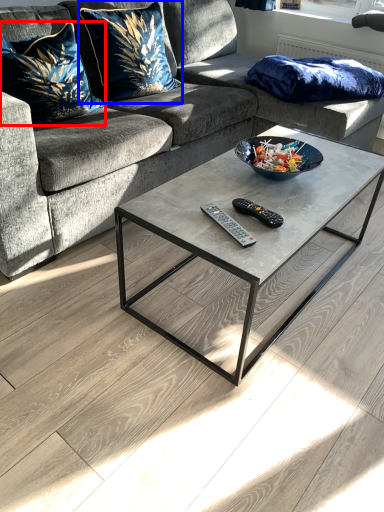
Question: Which object appears closest to the camera in this image, pillow (highlighted by a red box) or pillow (highlighted by a blue box)?

Choices:
 (A) pillow
 (B) pillow

Answer: (A)